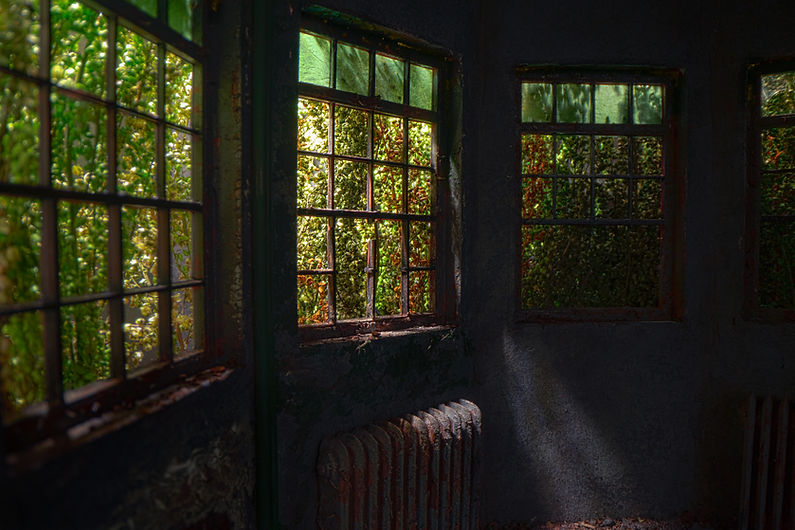
This screenshot has width=795, height=530. Identify the location of debris on floor. (571, 522), (650, 519).